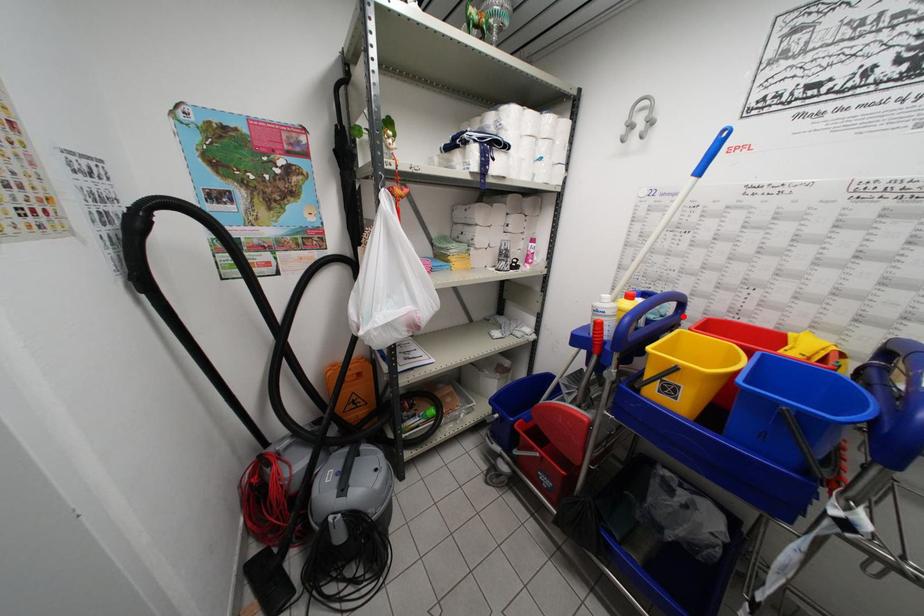
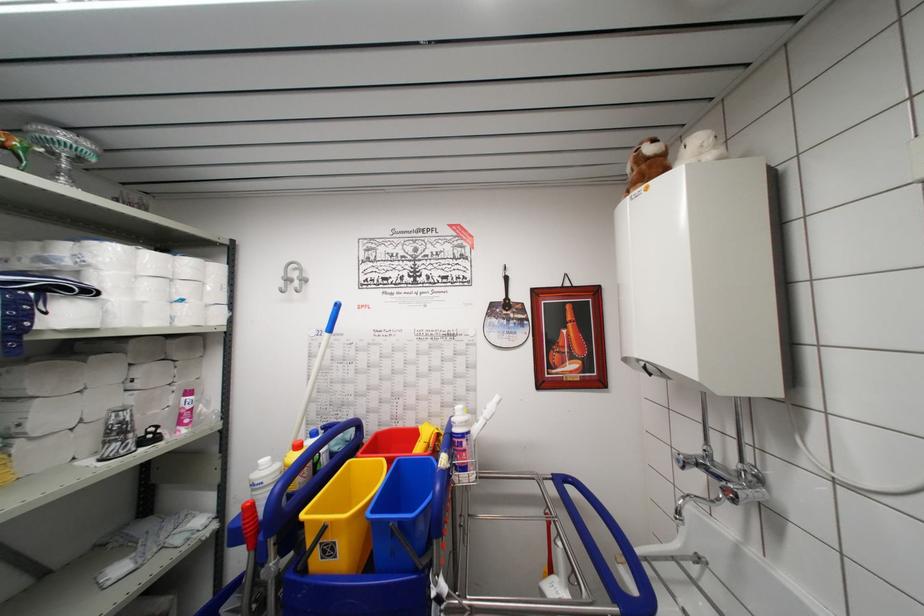
The point at the highlighted location is marked in the first image. Where is the corresponding point in the second image?

(361, 439)